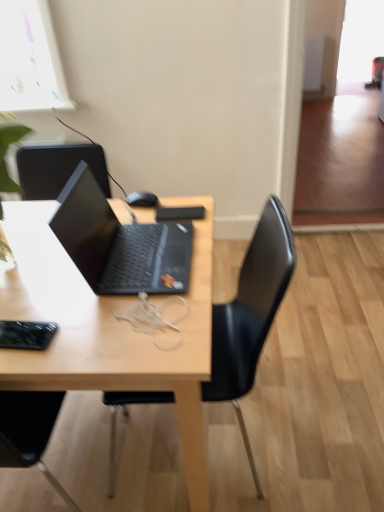
Where is `black plastic chair at center`? The image size is (384, 512). black plastic chair at center is located at coordinates (250, 314).

Where is `matte black laptop at center`? This screenshot has height=512, width=384. matte black laptop at center is located at coordinates (119, 243).

Could you tell me if matte black laptop at center is turned towards transparent glass window at upper right?

No, matte black laptop at center is not oriented towards transparent glass window at upper right.

Looking at the image, does matte black laptop at center seem bigger or smaller compared to transparent glass window at upper right?

matte black laptop at center is smaller than transparent glass window at upper right.

Who is taller, matte black laptop at center or transparent glass window at upper right?

Standing taller between the two is transparent glass window at upper right.

Between matte black laptop at center and wooden desk at center, which one has larger size?

With larger size is wooden desk at center.

From the image's perspective, is matte black laptop at center over wooden desk at center?

Correct, matte black laptop at center appears higher than wooden desk at center in the image.

Which object is further away from the camera taking this photo, matte black laptop at center or wooden desk at center?

matte black laptop at center.

Is black plastic chair at center positioned in front of wooden desk at center?

No, black plastic chair at center is behind wooden desk at center.

Measure the distance from black plastic chair at center to wooden desk at center.

black plastic chair at center and wooden desk at center are 11.61 inches apart from each other.

From the image's perspective, which one is positioned lower, black plastic chair at center or wooden desk at center?

wooden desk at center, from the image's perspective.

Considering their positions, is wooden desk at center located in front of or behind black plastic chair at center?

wooden desk at center is in front of black plastic chair at center.

From the image's perspective, relative to black plastic chair at center, is wooden desk at center above or below?

wooden desk at center is below black plastic chair at center.

Between point (59, 304) and point (208, 396), which one is positioned in front?

Point (59, 304)

From the picture: Which of these two, wooden desk at center or black plastic chair at center, stands shorter?

With less height is wooden desk at center.

Consider the image. Which object is more forward, black matte mouse at center or wooden desk at center?

Positioned in front is wooden desk at center.

How different are the orientations of black matte mouse at center and wooden desk at center in degrees?

There is a 79.7-degree angle between the facing directions of black matte mouse at center and wooden desk at center.

From their relative heights in the image, would you say black matte mouse at center is taller or shorter than wooden desk at center?

Considering their sizes, black matte mouse at center has less height than wooden desk at center.

Does black matte mouse at center have a lesser width compared to wooden desk at center?

Yes, black matte mouse at center is thinner than wooden desk at center.

Is black matte mouse at center wider or thinner than black plastic chair at center?

Clearly, black matte mouse at center has less width compared to black plastic chair at center.

Does black matte mouse at center lie in front of black plastic chair at center?

No.

Is black matte mouse at center with black plastic chair at center?

black matte mouse at center is not next to black plastic chair at center, and they're not touching.

Who is bigger, black matte mouse at center or black plastic chair at center?

With larger size is black plastic chair at center.

Is transparent glass window at upper right to the right of black plastic chair at center from the viewer's perspective?

Correct, you'll find transparent glass window at upper right to the right of black plastic chair at center.

Is transparent glass window at upper right taller than black plastic chair at center?

Yes.

From the image's perspective, which one is positioned higher, transparent glass window at upper right or black plastic chair at center?

transparent glass window at upper right, from the image's perspective.

Is transparent glass window at upper right bigger than black plastic chair at center?

Incorrect, transparent glass window at upper right is not larger than black plastic chair at center.

Image resolution: width=384 pixels, height=512 pixels. In order to click on laptop on the left of transparent glass window at upper right in this screenshot , I will do `click(119, 243)`.

Where is `desk in front of the matte black laptop at center`? The image size is (384, 512). desk in front of the matte black laptop at center is located at coordinates (107, 329).

Which object lies nearer to the anchor point wooden desk at center, black plastic chair at center or matte black laptop at center?

Among the two, matte black laptop at center is located nearer to wooden desk at center.

Considering their positions, is matte black laptop at center positioned closer to black matte mouse at center than black plastic chair at center?

The object closer to black matte mouse at center is matte black laptop at center.

From the image, which object appears to be farther from black plastic chair at center, black matte mouse at center or matte black laptop at center?

Based on the image, black matte mouse at center appears to be further to black plastic chair at center.

Which object lies further to the anchor point black plastic chair at center, matte black laptop at center or black matte mouse at center?

black matte mouse at center.

Which object lies further to the anchor point black plastic chair at center, transparent glass window at upper right or matte black laptop at center?

Based on the image, transparent glass window at upper right appears to be further to black plastic chair at center.

Considering their positions, is wooden desk at center positioned further to transparent glass window at upper right than matte black laptop at center?

matte black laptop at center is further to transparent glass window at upper right.

Estimate the real-world distances between objects in this image. Which object is further from wooden desk at center, transparent glass window at upper right or black plastic chair at center?

Based on the image, transparent glass window at upper right appears to be further to wooden desk at center.

Considering their positions, is transparent glass window at upper right positioned further to black matte mouse at center than matte black laptop at center?

transparent glass window at upper right lies further to black matte mouse at center than the other object.

Identify the location of chair between wooden desk at center and black matte mouse at center in the front-back direction. Image resolution: width=384 pixels, height=512 pixels. (250, 314).

This screenshot has width=384, height=512. What are the coordinates of `laptop between black plastic chair at center and transparent glass window at upper right along the z-axis` in the screenshot? It's located at (119, 243).

You are a GUI agent. You are given a task and a screenshot of the screen. Output one action in this format:
    pyautogui.click(x=<x>, y=<y>)
    Task: Click on the laptop positioned between wooden desk at center and transparent glass window at upper right from near to far
    
    Given the screenshot: What is the action you would take?
    pyautogui.click(x=119, y=243)

Image resolution: width=384 pixels, height=512 pixels. I want to click on laptop between black plastic chair at center and black matte mouse at center in the front-back direction, so click(x=119, y=243).